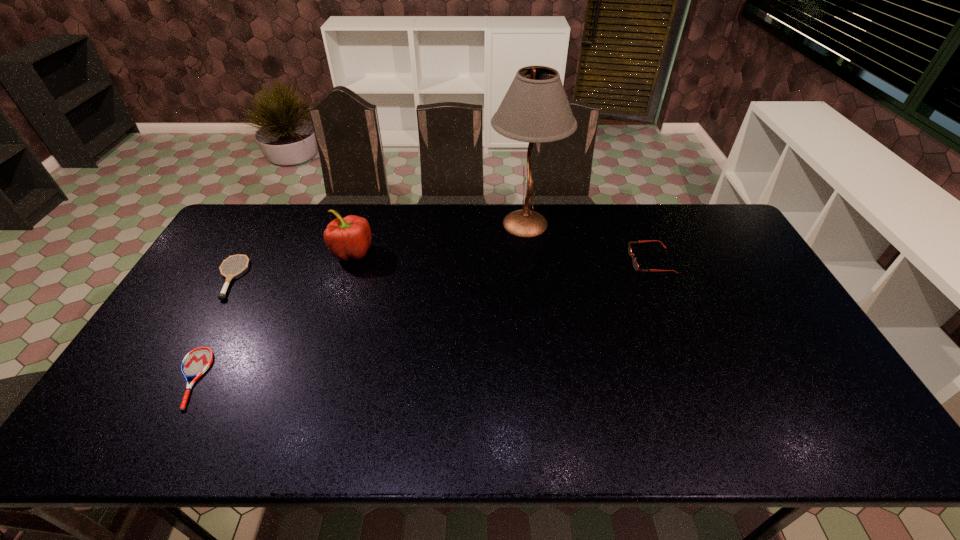
Where is `empty space that is in between the third shortest object and the tallest object`? This screenshot has height=540, width=960. empty space that is in between the third shortest object and the tallest object is located at coordinates (588, 242).

Find the location of a particular element. vacant area that lies between the shortest object and the tallest object is located at coordinates (357, 301).

You are a GUI agent. You are given a task and a screenshot of the screen. Output one action in this format:
    pyautogui.click(x=<x>, y=<y>)
    Task: Click on the vacant area that lies between the shorter tennis racket and the spectacles
    
    Given the screenshot: What is the action you would take?
    pyautogui.click(x=420, y=319)

Locate an element on the screen. Image resolution: width=960 pixels, height=540 pixels. vacant area that lies between the third object from left to right and the second shortest object is located at coordinates (291, 265).

This screenshot has width=960, height=540. I want to click on empty space that is in between the tallest object and the taller tennis racket, so click(x=377, y=251).

Find the location of `empty space between the fourth object from left to right and the nearer tennis racket`. empty space between the fourth object from left to right and the nearer tennis racket is located at coordinates (357, 301).

Locate an element on the screen. object that stands as the fourth closest to the table lamp is located at coordinates (196, 362).

You are a GUI agent. You are given a task and a screenshot of the screen. Output one action in this format:
    pyautogui.click(x=<x>, y=<y>)
    Task: Click on the object that ranks as the third closest to the third tallest object
    
    Given the screenshot: What is the action you would take?
    pyautogui.click(x=196, y=362)

This screenshot has height=540, width=960. What are the coordinates of `free region that satisfies the following two spatial constraints: 1. on the front-facing side of the table lamp; 2. on the front side of the farther tennis racket` in the screenshot? It's located at (532, 278).